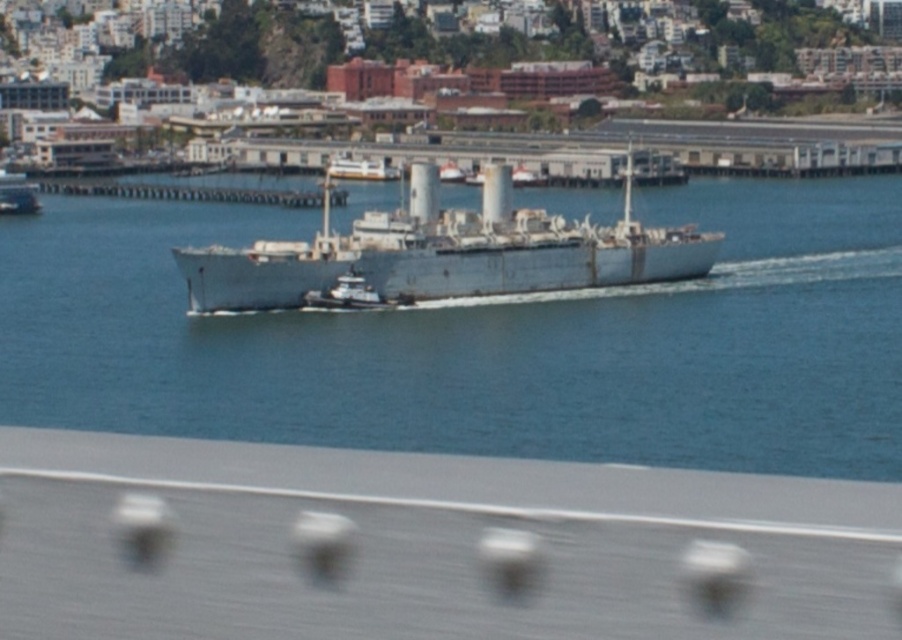
Consider the image. Is gray metallic ship at center below white matte ship at center?

Indeed, gray metallic ship at center is positioned under white matte ship at center.

Is gray metallic ship at center smaller than white matte ship at center?

Actually, gray metallic ship at center might be larger than white matte ship at center.

Identify the location of gray metallic ship at center. The image size is (902, 640). (447, 252).

Is point (229, 397) closer to viewer compared to point (659, 264)?

Yes, it is.

Does blue water at center have a greater height compared to gray metallic ship at center?

Yes.

Describe the element at coordinates (484, 340) in the screenshot. I see `blue water at center` at that location.

At what (x,y) coordinates should I click in order to perform the action: click on blue water at center. Please return your answer as a coordinate pair (x, y). Image resolution: width=902 pixels, height=640 pixels. Looking at the image, I should click on (484, 340).

Is blue water at center below white matte ship at center?

Indeed, blue water at center is positioned under white matte ship at center.

Which is below, blue water at center or white matte ship at center?

blue water at center is below.

Who is more forward, (233,392) or (12,177)?

Point (233,392) is more forward.

Find the location of a particular element. The image size is (902, 640). blue water at center is located at coordinates (484, 340).